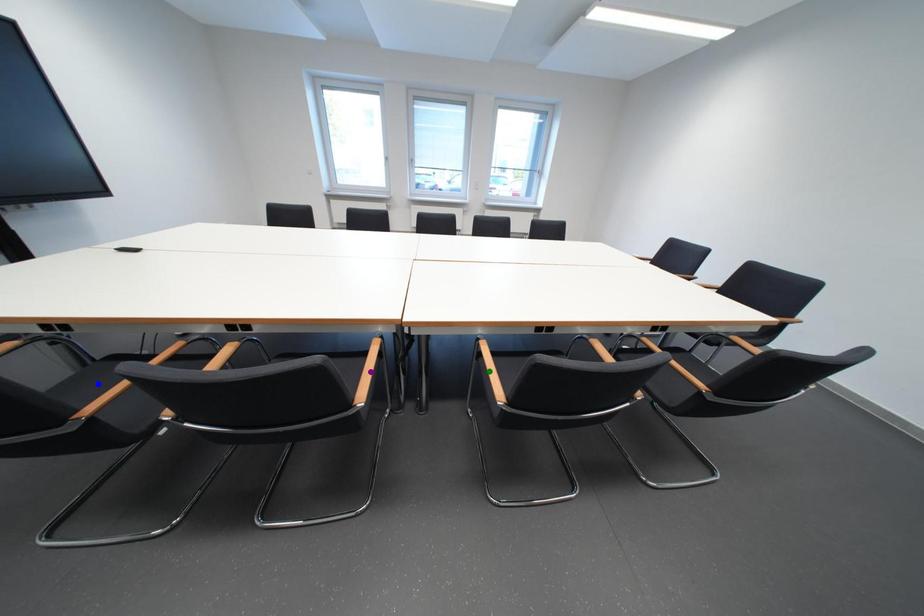
Order these from nearest to farthest:
purple point
blue point
green point

blue point
green point
purple point